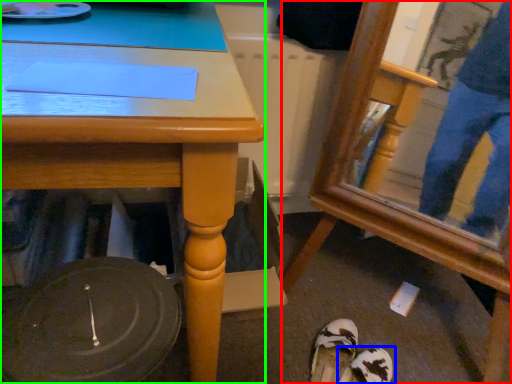
Question: Based on their relative distances, which object is nearer to swivel chair (highlighted by a red box)? Choose from footwear (highlighted by a blue box) and desk (highlighted by a green box).

Choices:
 (A) footwear
 (B) desk

Answer: (A)